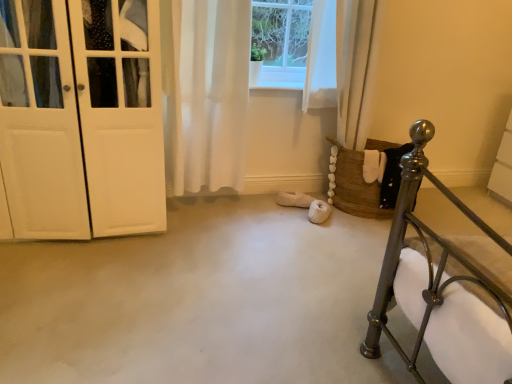
What is the approximate height of white matte door at left?

white matte door at left is 3.97 feet in height.

Describe the element at coordinates (81, 118) in the screenshot. I see `white matte door at left` at that location.

Image resolution: width=512 pixels, height=384 pixels. I want to click on white matte door at left, so click(81, 118).

I want to click on white sheer curtain at center, so (205, 92).

Describe the element at coordinates (205, 92) in the screenshot. I see `white sheer curtain at center` at that location.

In order to face white sheer curtain at center, should I rotate leftwards or rightwards?

Turn left approximately 5.078 degrees to face it.

The image size is (512, 384). What are the coordinates of `white matte door at left` in the screenshot? It's located at [81, 118].

Which object is positioned more to the left, white matte door at left or white sheer curtain at center?

From the viewer's perspective, white matte door at left appears more on the left side.

Considering their positions, is white matte door at left located in front of or behind white sheer curtain at center?

white matte door at left is in front of white sheer curtain at center.

Is point (108, 71) closer to viewer compared to point (192, 64)?

Yes, point (108, 71) is closer to viewer.

From the image's perspective, would you say white matte door at left is positioned over white sheer curtain at center?

No, from the image's perspective, white matte door at left is not above white sheer curtain at center.

From a real-world perspective, is white matte door at left positioned above or below white sheer curtain at center?

white matte door at left is below white sheer curtain at center.

Does white matte door at left have a greater width compared to white sheer curtain at center?

Indeed, white matte door at left has a greater width compared to white sheer curtain at center.

Does white matte door at left have a greater height compared to white sheer curtain at center?

Yes.

Does white matte door at left have a larger size compared to white sheer curtain at center?

Correct, white matte door at left is larger in size than white sheer curtain at center.

Is white matte door at left not inside white sheer curtain at center?

That's correct, white matte door at left is outside of white sheer curtain at center.

Is white matte door at left next to white sheer curtain at center?

No, white matte door at left is not beside white sheer curtain at center.

Is white sheer curtain at center at the back of white matte door at left?

white matte door at left is not turned away from white sheer curtain at center.

What's the angular difference between white matte door at left and white sheer curtain at center's facing directions?

0.457 degrees separate the facing orientations of white matte door at left and white sheer curtain at center.

From the picture: Measure the distance between white matte door at left and white sheer curtain at center.

white matte door at left is 17.55 inches away from white sheer curtain at center.

In order to click on curtain positioned vertically above the white matte door at left (from a real-world perspective) in this screenshot , I will do `click(205, 92)`.

Considering the positions of objects white sheer curtain at center and white matte door at left in the image provided, who is more to the right, white sheer curtain at center or white matte door at left?

white sheer curtain at center.

Considering their positions, is white sheer curtain at center located in front of or behind white matte door at left?

white sheer curtain at center is positioned farther from the viewer than white matte door at left.

Between point (201, 115) and point (117, 48), which one is positioned behind?

The point (201, 115) is more distant.

From the image's perspective, does white sheer curtain at center appear higher than white matte door at left?

Correct, white sheer curtain at center appears higher than white matte door at left in the image.

In the scene shown: From a real-world perspective, is white sheer curtain at center under white matte door at left?

No, from a real-world perspective, white sheer curtain at center is not under white matte door at left.

In terms of width, does white sheer curtain at center look wider or thinner when compared to white matte door at left?

white sheer curtain at center is thinner than white matte door at left.

Is white sheer curtain at center shorter than white matte door at left?

Correct, white sheer curtain at center is not as tall as white matte door at left.

Can you confirm if white sheer curtain at center is smaller than white matte door at left?

Yes.

Is white sheer curtain at center completely or partially outside of white matte door at left?

That's correct, white sheer curtain at center is outside of white matte door at left.

Is white sheer curtain at center beside white matte door at left?

They are not placed beside each other.

Is white sheer curtain at center oriented towards white matte door at left?

No, white sheer curtain at center is not facing towards white matte door at left.

Can you tell me how much white sheer curtain at center and white matte door at left differ in facing direction?

They differ by 0.457 degrees in their facing directions.

Locate an element on the screen. The width and height of the screenshot is (512, 384). door in front of the white sheer curtain at center is located at coordinates (81, 118).

Where is `door below the white sheer curtain at center (from the image's perspective)`? This screenshot has height=384, width=512. door below the white sheer curtain at center (from the image's perspective) is located at coordinates (81, 118).

Find the location of `curtain that appears on the right of white matte door at left`. curtain that appears on the right of white matte door at left is located at coordinates (205, 92).